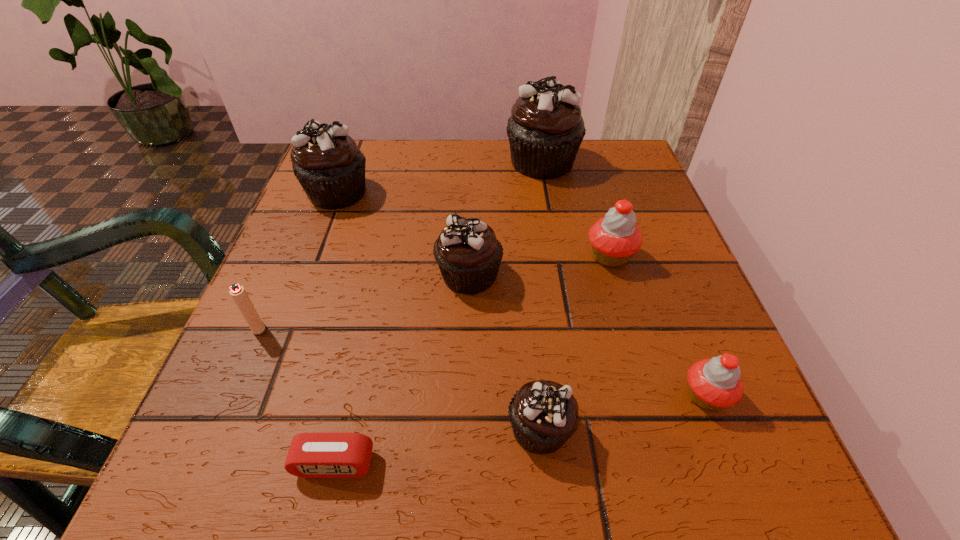
Where is `alarm clock present at the near edge`? alarm clock present at the near edge is located at coordinates (311, 455).

Where is `cupcake at the left edge`? This screenshot has width=960, height=540. cupcake at the left edge is located at coordinates (330, 167).

The height and width of the screenshot is (540, 960). In order to click on igniter at the left edge in this screenshot , I will do `click(237, 292)`.

This screenshot has width=960, height=540. In order to click on alarm clock at the left edge in this screenshot , I will do `click(311, 455)`.

At what (x,y) coordinates should I click in order to perform the action: click on object at the far left corner. Please return your answer as a coordinate pair (x, y). Looking at the image, I should click on (330, 167).

This screenshot has height=540, width=960. Identify the location of object positioned at the near left corner. (311, 455).

I want to click on object at the far right corner, so click(545, 130).

The image size is (960, 540). In order to click on free spot at the far edge of the desktop in this screenshot , I will do tap(485, 152).

Where is `vacant space at the near edge of the desktop`? This screenshot has height=540, width=960. vacant space at the near edge of the desktop is located at coordinates (322, 502).

In order to click on free spot at the left edge of the desktop in this screenshot , I will do `click(230, 413)`.